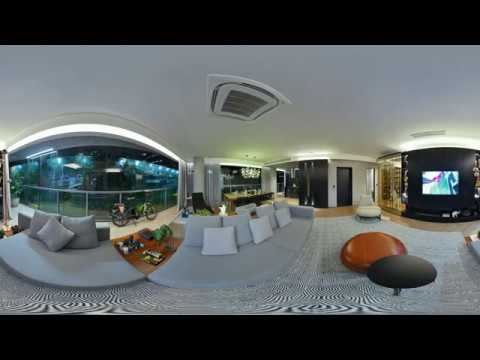
Where is `window`? Image resolution: width=480 pixels, height=360 pixels. window is located at coordinates (89, 169).